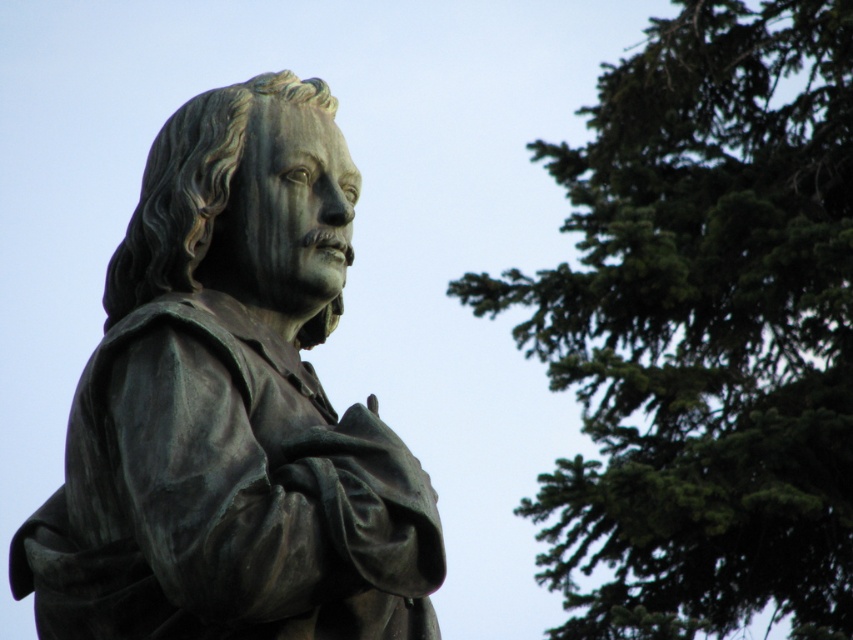
Does green needle-like leaves at upper right have a greater width compared to bronze statue at left?

Yes.

Who is more distant from viewer, (x=625, y=397) or (x=148, y=353)?

Positioned behind is point (x=625, y=397).

Locate an element on the screen. This screenshot has width=853, height=640. green needle-like leaves at upper right is located at coordinates (703, 330).